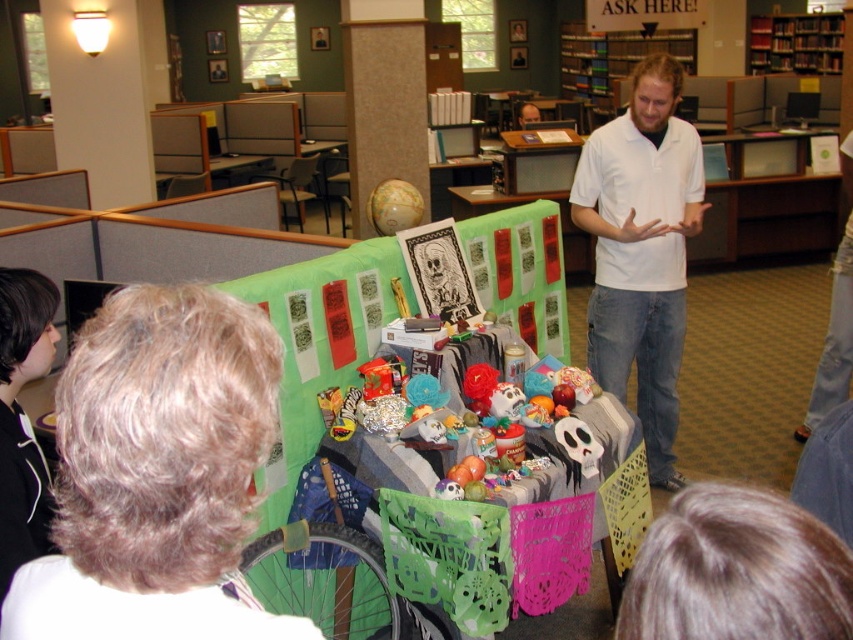
Question: Can you confirm if blonde hair at upper left is bigger than dark brown hair at lower right?

Choices:
 (A) no
 (B) yes

Answer: (B)

Question: Which point appears farthest from the camera in this image?

Choices:
 (A) (27, 340)
 (B) (218, 307)

Answer: (A)

Question: Does blonde hair at upper left have a greater width compared to white cotton shirt at center?

Choices:
 (A) no
 (B) yes

Answer: (B)

Question: Which point is closer to the camera?

Choices:
 (A) dark brown hair at lower right
 (B) black hoodie at lower left

Answer: (A)

Question: Based on their relative distances, which object is farther from the black hoodie at lower left?

Choices:
 (A) dark brown hair at lower right
 (B) white cotton shirt at center

Answer: (B)

Question: Is blonde hair at upper left wider than white cotton shirt at center?

Choices:
 (A) yes
 (B) no

Answer: (A)